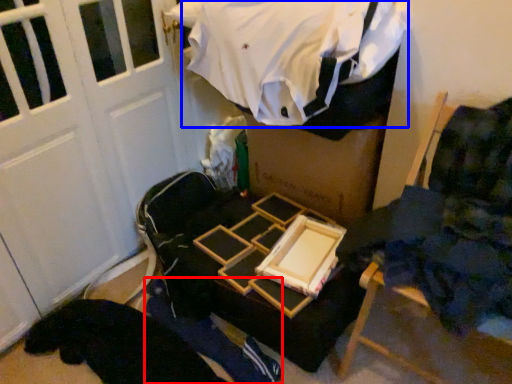
Question: Which object appears farthest to the camera in this image, person (highlighted by a red box) or clothing (highlighted by a blue box)?

Choices:
 (A) person
 (B) clothing

Answer: (A)